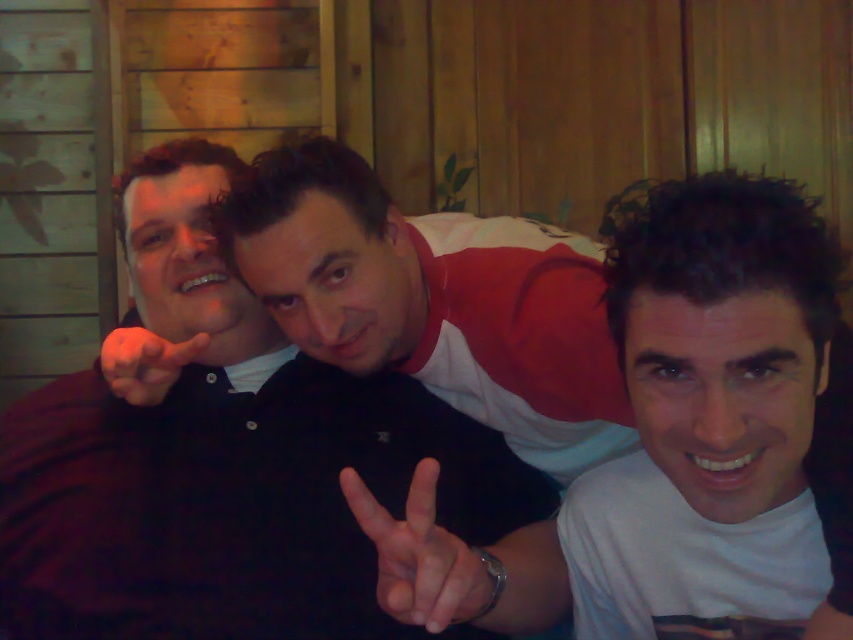
From the picture: You are a photographer adjusting the focus on your camera. You notice the white matte shirt at center and the smooth skin hand at center. Which object should you focus on first if you want to ensure both are in focus, considering their sizes?

The white matte shirt at center has a larger size compared to smooth skin hand at center, so focusing on the larger white matte shirt at center first would help ensure both are in focus.

You are taking a photo of the black matte shirt at center and the smooth skin hand at center. Which object is positioned to the right of the other?

The black matte shirt at center is to the right of smooth skin hand at center.